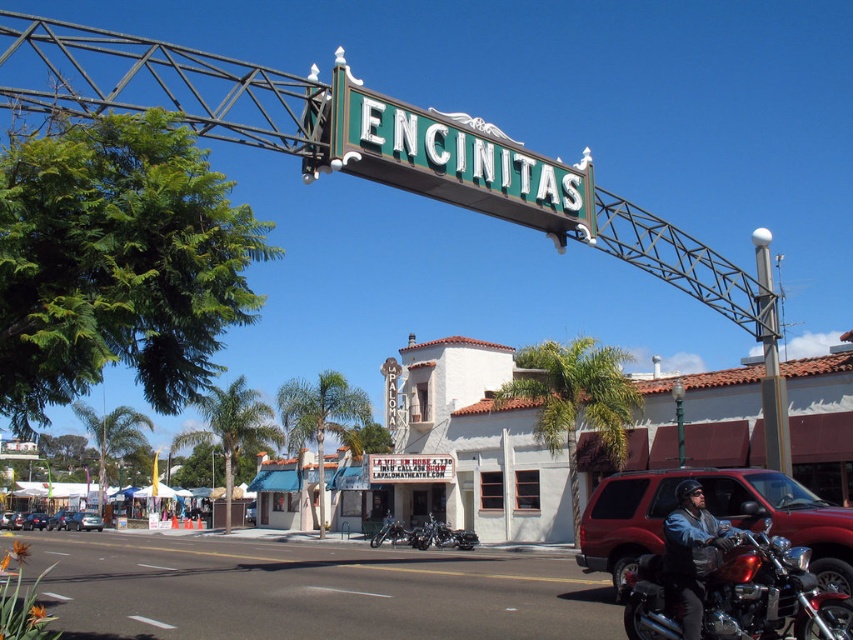
Which is behind, point (810, 529) or point (51, 518)?

The point (51, 518) is behind.

Can you confirm if matte red suv at lower right is positioned above metallic silver sedan at center?

Yes.

Locate an element on the screen. matte red suv at lower right is located at coordinates (714, 515).

Where is `matte red suv at lower right`? This screenshot has width=853, height=640. matte red suv at lower right is located at coordinates (714, 515).

Is leather jacket at center closer to camera compared to matte black car at lower left?

Yes, it is in front of matte black car at lower left.

Is point (672, 573) positioned behind point (38, 515)?

No, it is not.

Which is behind, point (668, 560) or point (28, 513)?

Point (28, 513)

Identify the location of leather jacket at center. Image resolution: width=853 pixels, height=640 pixels. (692, 554).

The height and width of the screenshot is (640, 853). Find the location of `green metallic sign at center`. green metallic sign at center is located at coordinates (456, 161).

Can you confirm if green metallic sign at center is positioned below matte red suv at lower right?

Actually, green metallic sign at center is above matte red suv at lower right.

The image size is (853, 640). What do you see at coordinates (456, 161) in the screenshot? I see `green metallic sign at center` at bounding box center [456, 161].

The image size is (853, 640). Find the location of `green metallic sign at center`. green metallic sign at center is located at coordinates (456, 161).